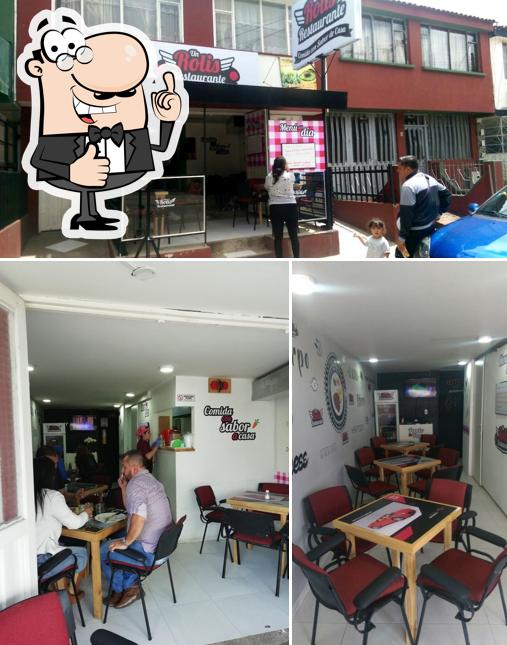
Find the location of a particular element. Image resolution: width=507 pixels, height=645 pixels. cracks in the ceiling is located at coordinates (193, 309), (262, 315).